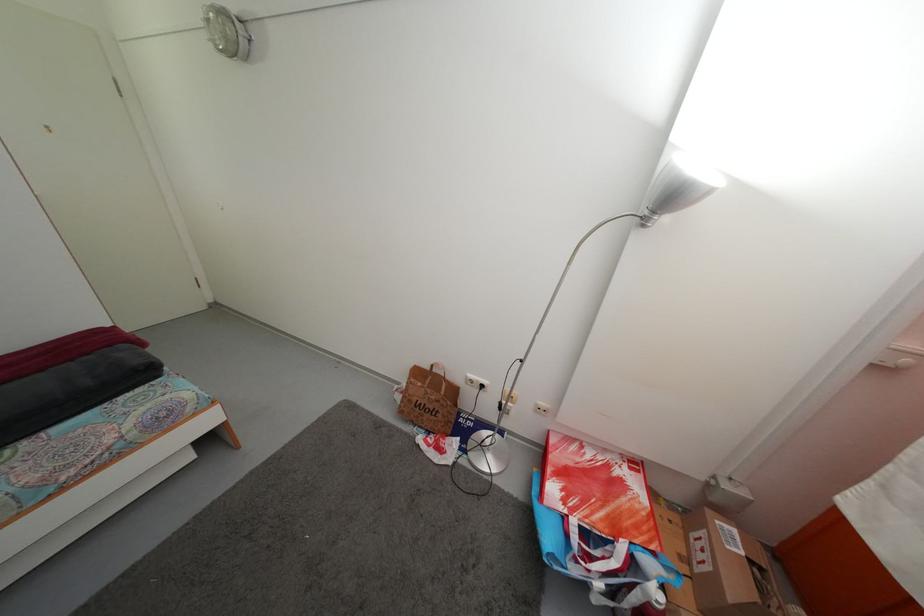
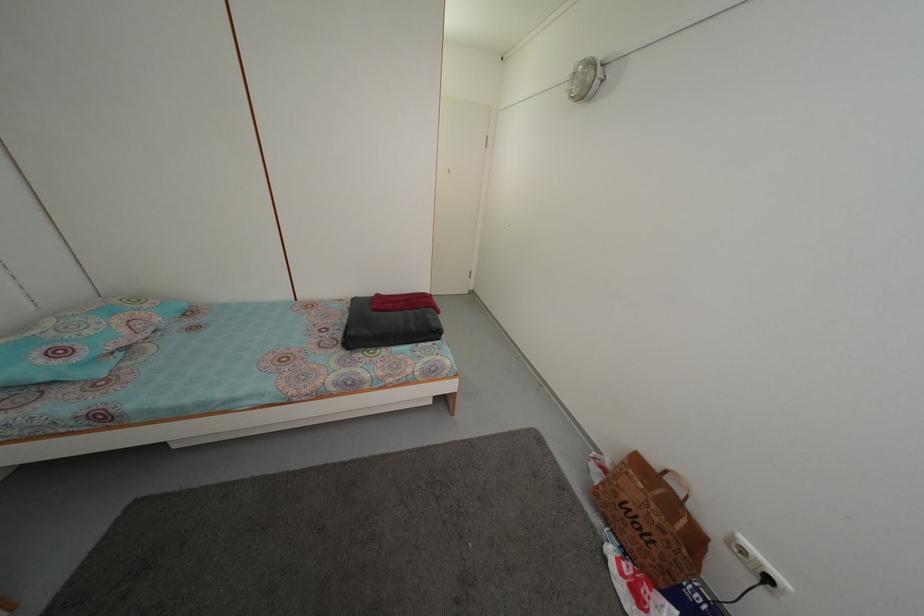
In the second image, find the point that corresponds to (472,390) in the first image.

(733, 551)